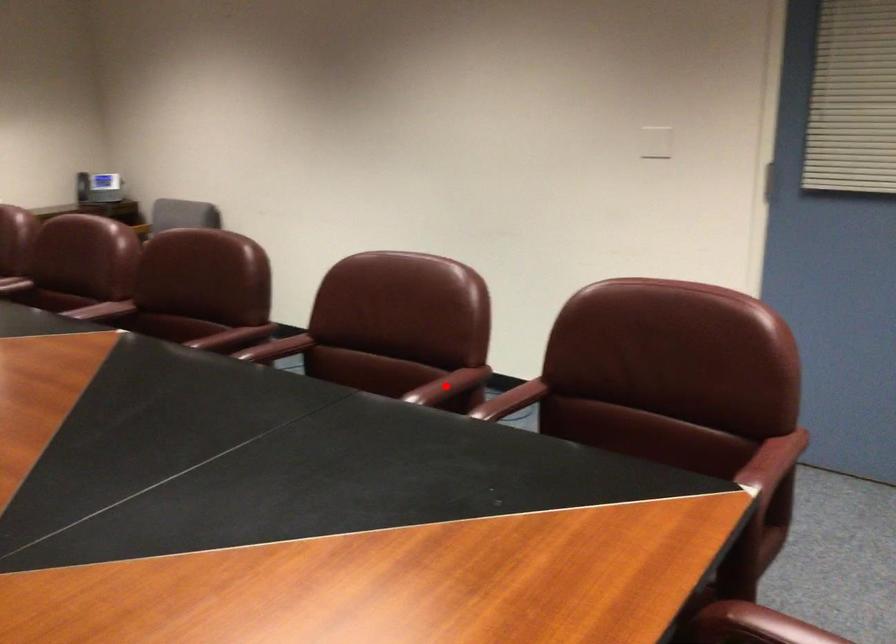
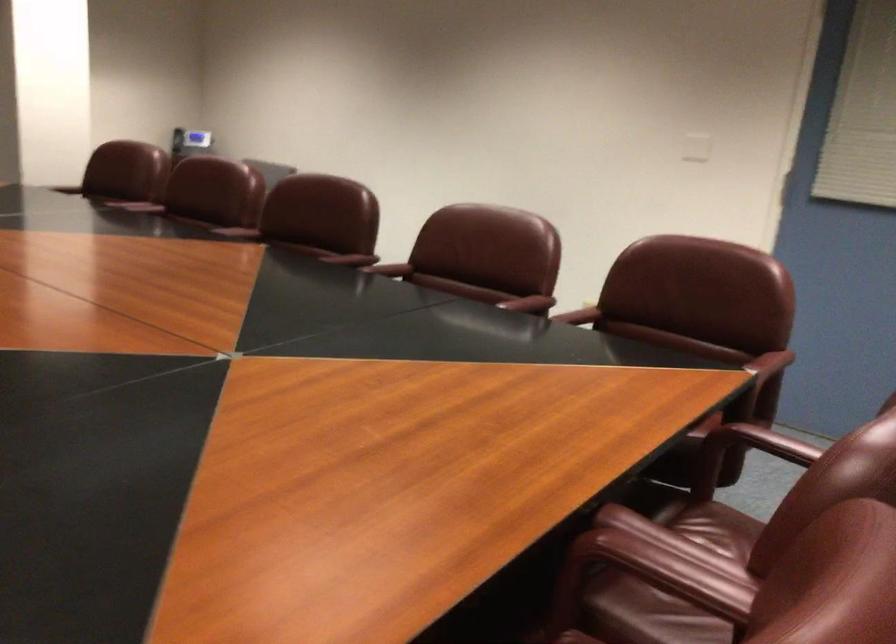
Question: I am providing you with two images of the same scene from different viewpoints. Image1 has a red point marked. In image2, the corresponding 3D location appears at what relative position? Reply with the corresponding letter.

Choices:
 (A) Closer
 (B) Farther

Answer: (B)